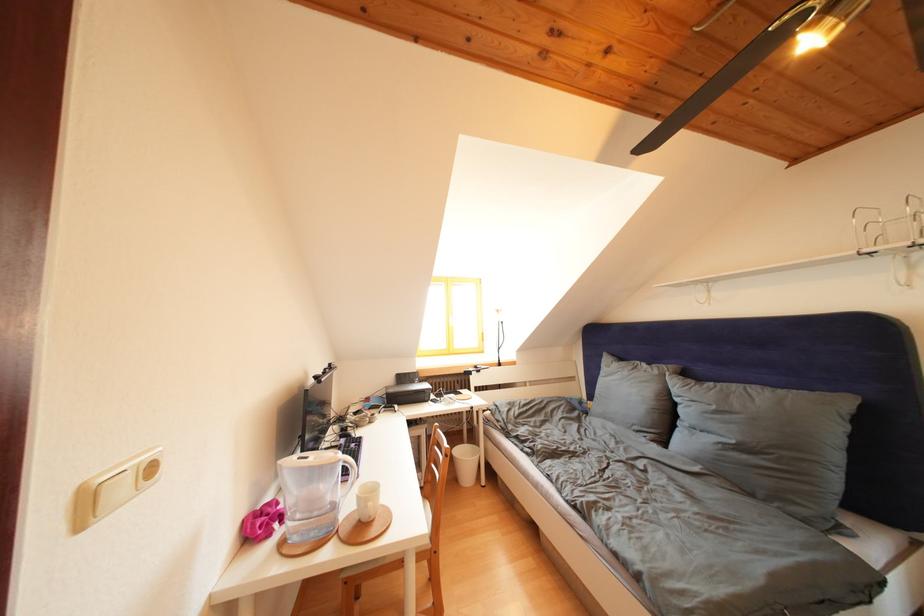
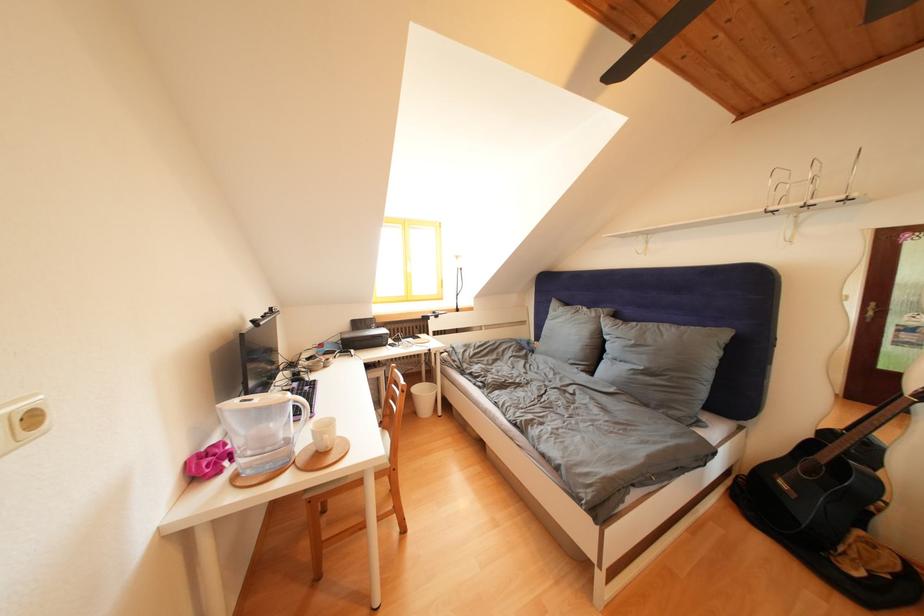
In the second image, find the point that corresponds to (x=159, y=474) in the first image.

(41, 424)